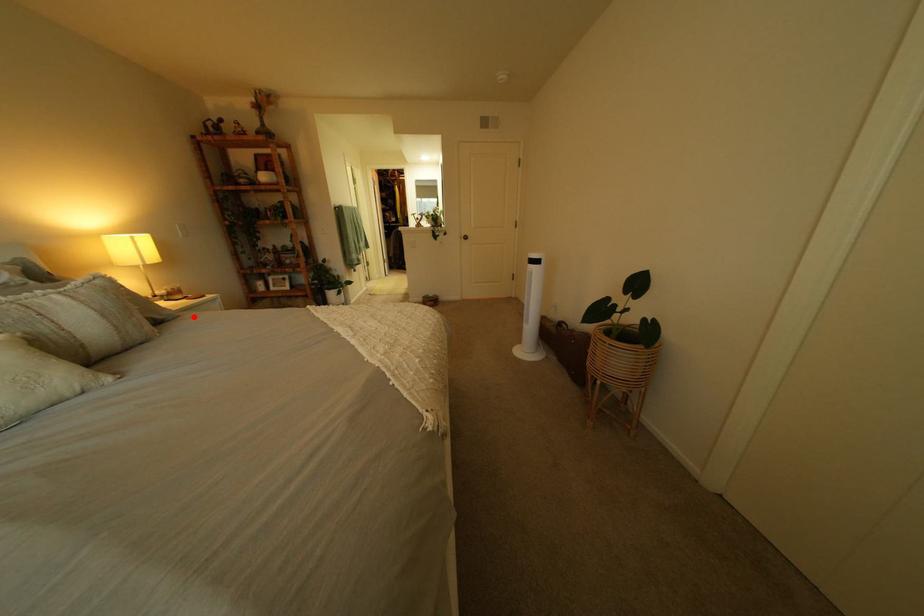
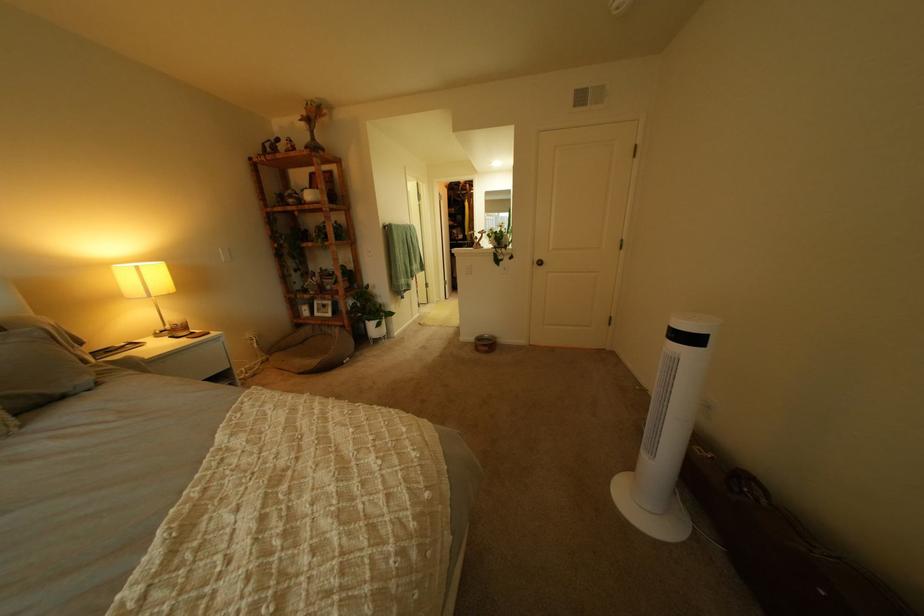
Where in the second image is the point corresponding to the highlighted location from the first image?

(115, 385)